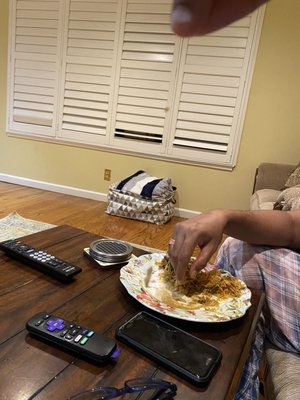
I want to click on couch, so click(x=270, y=192).